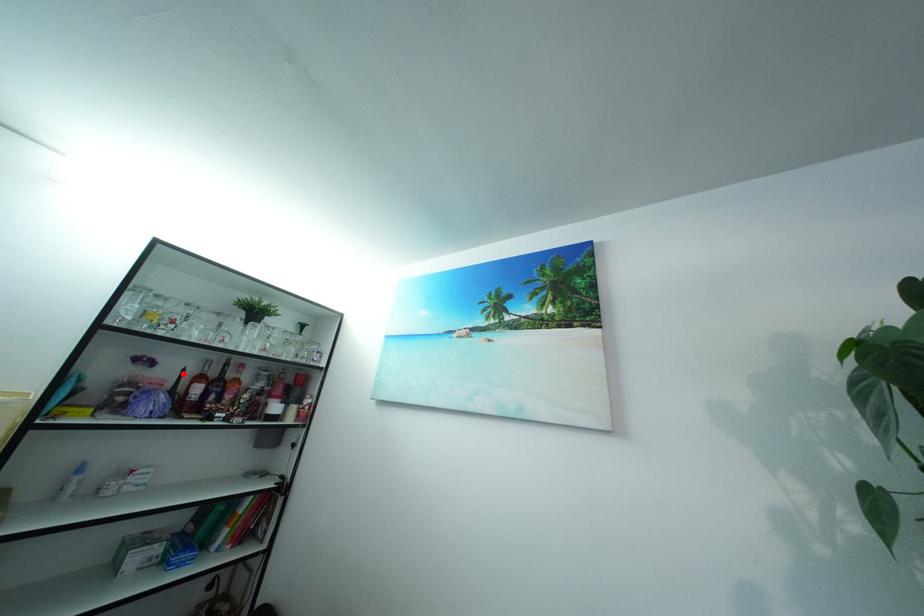
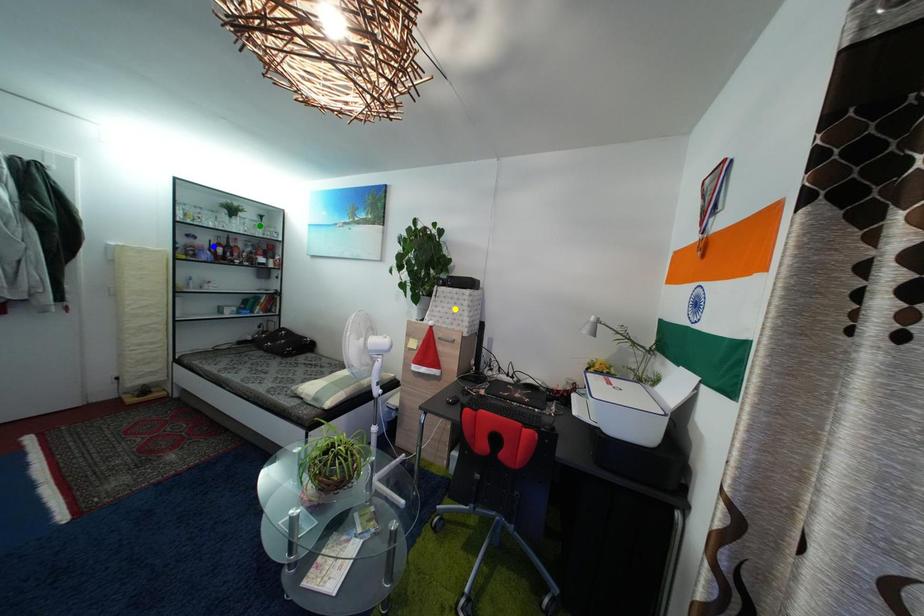
Question: I am providing you with two images of the same scene from different viewpoints. A red point is marked on the first image. You are given multiple points on the second image. In image 2, which mark is for the same physical point as the one in image 1?

Choices:
 (A) green point
 (B) yellow point
 (C) blue point

Answer: (C)